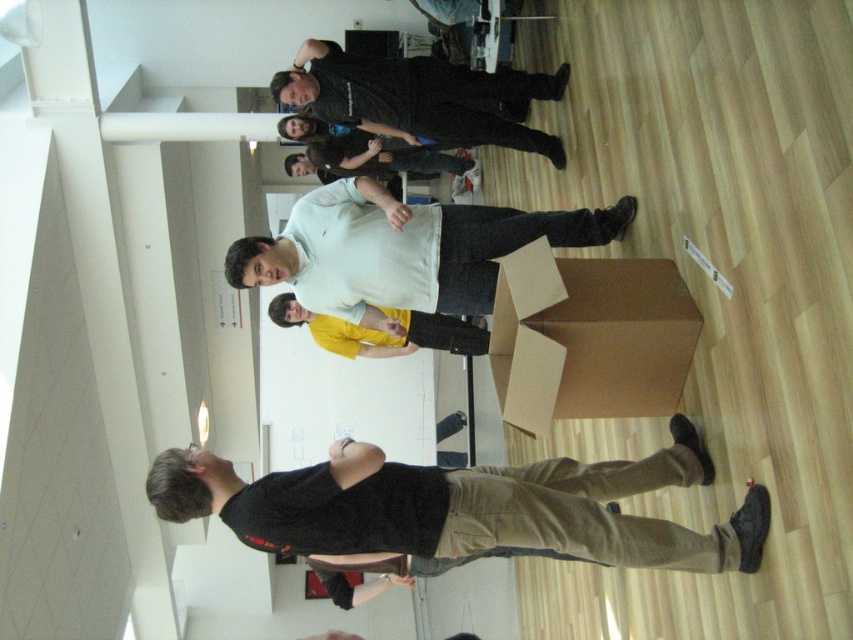
Looking at this image, who is positioned more to the right, white matte shirt at center or yellow matte shirt at center?

Positioned to the right is white matte shirt at center.

Is point (527, 220) farther from viewer compared to point (419, 340)?

No, it is not.

Is point (323, 208) more distant than point (309, 330)?

No.

Locate an element on the screen. Image resolution: width=853 pixels, height=640 pixels. white matte shirt at center is located at coordinates (403, 250).

Does black cotton shirt at lower left appear on the right side of dark blue shirt at center?

Indeed, black cotton shirt at lower left is positioned on the right side of dark blue shirt at center.

Is black cotton shirt at lower left thinner than dark blue shirt at center?

No, black cotton shirt at lower left is not thinner than dark blue shirt at center.

Does point (366, 458) come behind point (303, 166)?

No.

The image size is (853, 640). I want to click on black cotton shirt at lower left, so click(463, 506).

Image resolution: width=853 pixels, height=640 pixels. Identify the location of black cotton shirt at lower left. (463, 506).

Is black cotton shirt at lower left further to camera compared to dark gray shirt at center?

No, it is not.

Who is more distant from viewer, (677, 483) or (299, 72)?

Point (299, 72)

Locate an element on the screen. Image resolution: width=853 pixels, height=640 pixels. black cotton shirt at lower left is located at coordinates (463, 506).